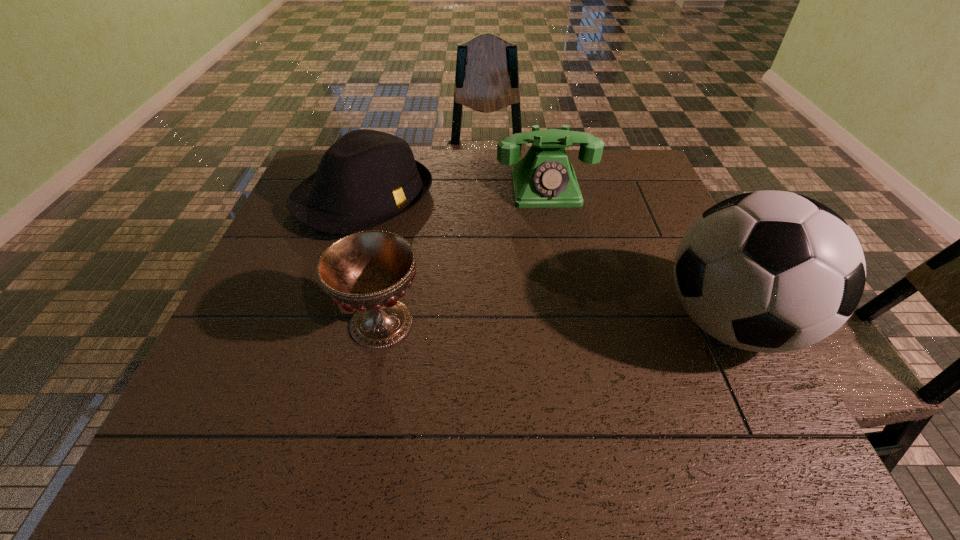
The height and width of the screenshot is (540, 960). What are the coordinates of `chalice` in the screenshot? It's located at (368, 271).

The image size is (960, 540). What are the coordinates of `soccer ball` in the screenshot? It's located at pos(768,271).

This screenshot has width=960, height=540. I want to click on the tallest object, so click(x=768, y=271).

What are the coordinates of `the second object from right to left` in the screenshot? It's located at (544, 178).

This screenshot has height=540, width=960. In order to click on fedora in this screenshot , I will do `click(366, 178)`.

This screenshot has width=960, height=540. What are the coordinates of `vacant space situated on the right of the chalice` in the screenshot? It's located at (562, 323).

Identify the location of vacant space situated 0.190m on the left of the rightmost object. coord(568,323).

This screenshot has height=540, width=960. Identify the location of free space located on the dial of the third object from left to right. (562, 260).

Where is `free space located 0.360m on the dial of the third object from left to right`? This screenshot has width=960, height=540. free space located 0.360m on the dial of the third object from left to right is located at coordinates (572, 307).

Image resolution: width=960 pixels, height=540 pixels. I want to click on vacant region located 0.360m on the dial of the third object from left to right, so click(x=572, y=307).